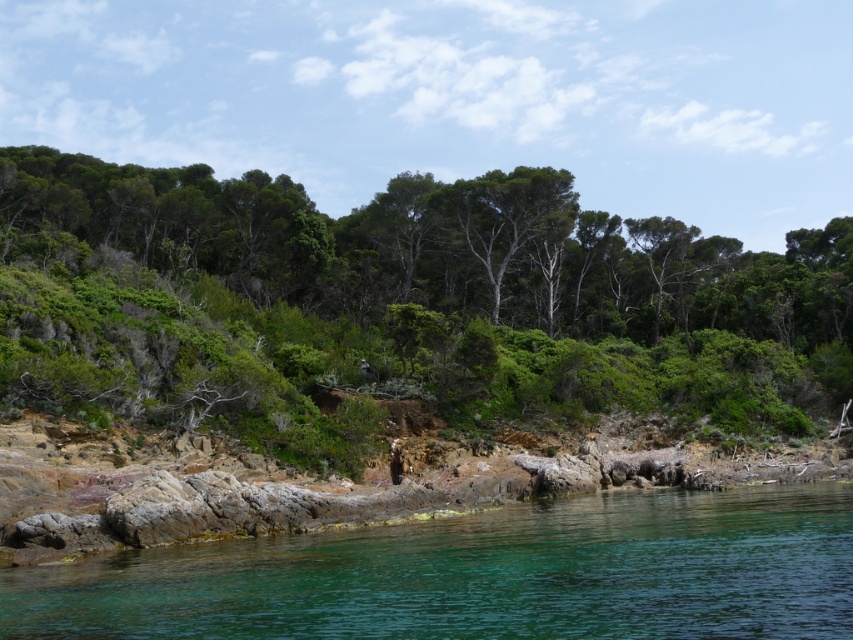
Which is above, green leafy trees at center or clear water at lower left?

green leafy trees at center

Consider the image. How distant is green leafy trees at center from clear water at lower left?

35.78 meters

Locate an element on the screen. Image resolution: width=853 pixels, height=640 pixels. green leafy trees at center is located at coordinates (398, 305).

Find the location of a particular element. green leafy trees at center is located at coordinates (398, 305).